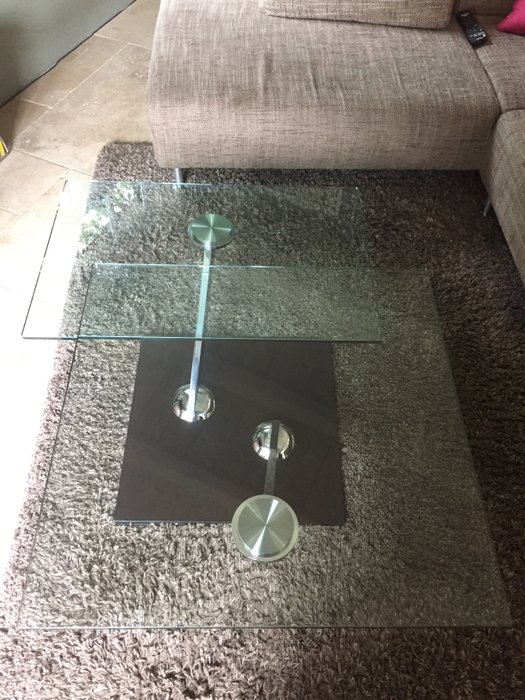
The width and height of the screenshot is (525, 700). Find the location of `white grout lines`. white grout lines is located at coordinates (43, 161), (84, 80).